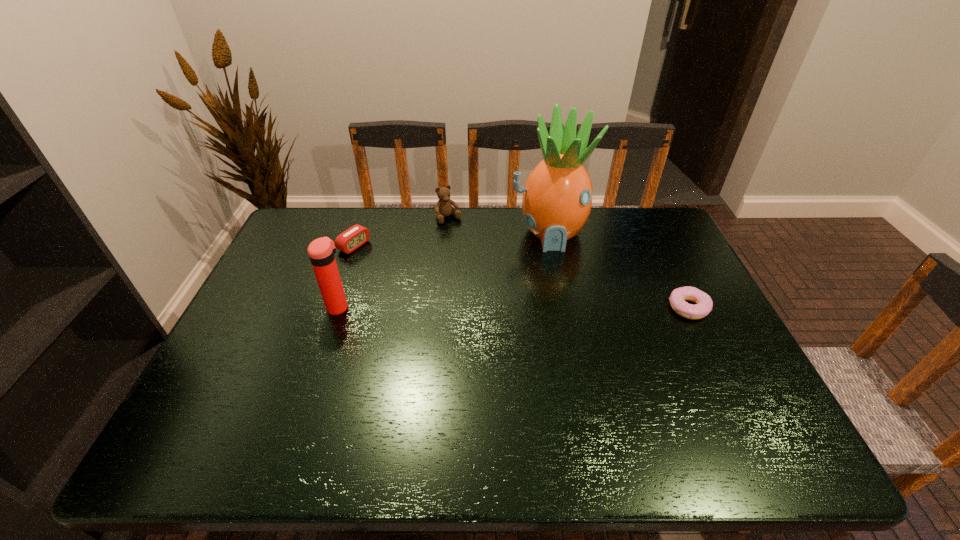
Where is `vacant space that is in between the doughnut and the alarm clock`? The height and width of the screenshot is (540, 960). vacant space that is in between the doughnut and the alarm clock is located at coordinates (521, 276).

The height and width of the screenshot is (540, 960). Find the location of `free space between the shortest object and the tallest object`. free space between the shortest object and the tallest object is located at coordinates (619, 271).

The width and height of the screenshot is (960, 540). Identify the location of unoccupied position between the tallest object and the alarm clock. (451, 239).

At what (x,y) coordinates should I click in order to perform the action: click on vacant area between the shortest object and the fourth tallest object. Please return your answer as a coordinate pair (x, y). The width and height of the screenshot is (960, 540). Looking at the image, I should click on (521, 276).

In order to click on empty space between the alarm clock and the second tallest object in this screenshot , I will do `click(347, 276)`.

The width and height of the screenshot is (960, 540). Identify the location of unoccupied position between the alarm clock and the shortest object. (521, 276).

Where is `vacant region between the doughnut and the fourth tallest object`? vacant region between the doughnut and the fourth tallest object is located at coordinates (521, 276).

Find the location of a particular element. Image resolution: width=960 pixels, height=540 pixels. blank region between the alarm clock and the thermos bottle is located at coordinates (347, 276).

The width and height of the screenshot is (960, 540). In order to click on free space that is in between the shortest object and the thermos bottle in this screenshot , I will do `click(514, 308)`.

This screenshot has width=960, height=540. Find the location of `empty location between the third shortest object and the thermos bottle`. empty location between the third shortest object and the thermos bottle is located at coordinates (394, 262).